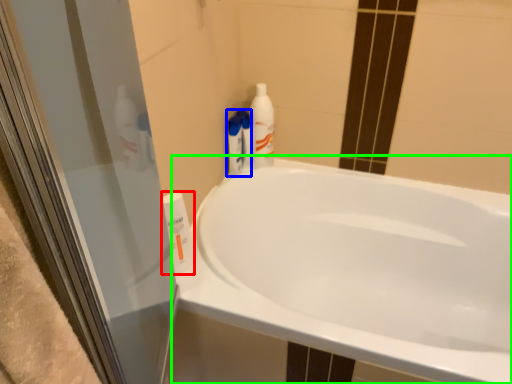
Question: Based on their relative distances, which object is nearer to cleaning product (highlighted by a red box)? Choose from cleaning product (highlighted by a blue box) and bathtub (highlighted by a green box).

Choices:
 (A) cleaning product
 (B) bathtub

Answer: (A)